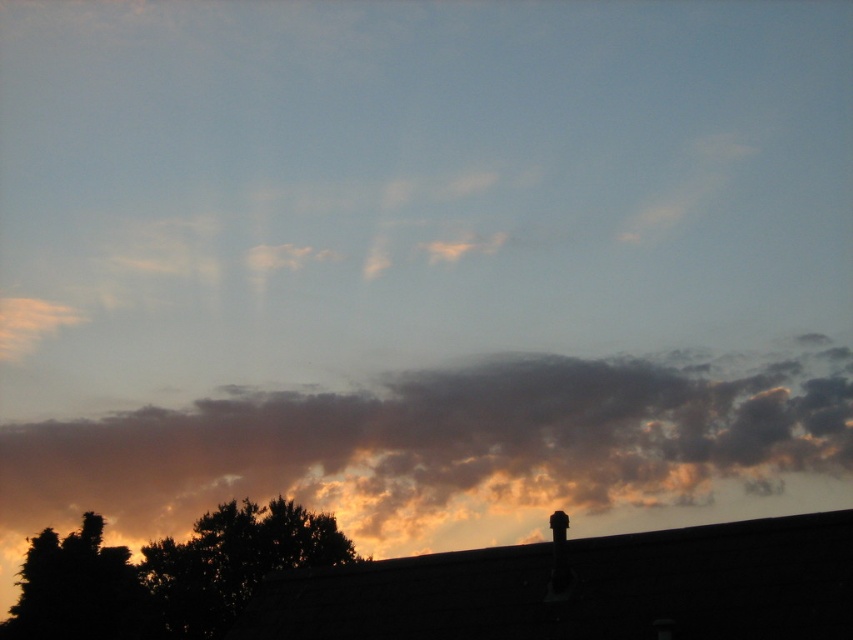
You are standing in a field observing the silhouette leafy tree at lower left and the dark green leafy tree at lower left. Which tree is shorter?

The silhouette leafy tree at lower left is shorter than the dark green leafy tree at lower left.